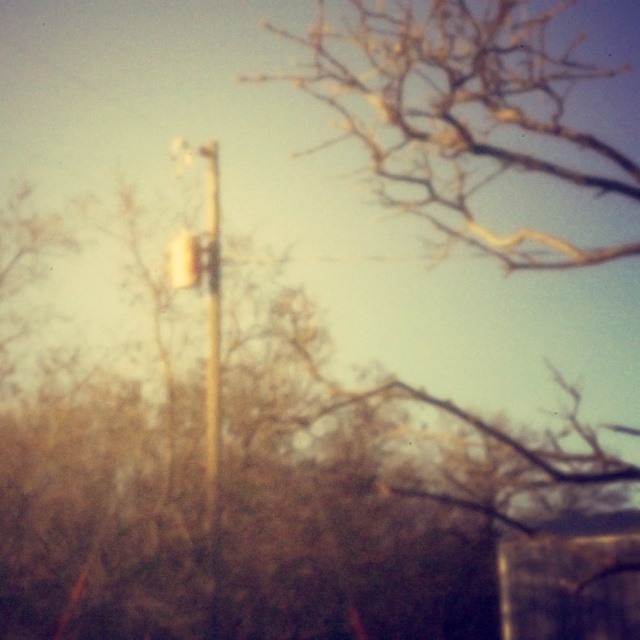
You are a pedestrian standing on the sidewalk and see the wooden pole at center and the metallic silver traffic light at center. Which object is positioned more to the right from your viewpoint?

The wooden pole at center is positioned more to the right than the metallic silver traffic light at center according to the description.

You are driving a car and need to stop at the traffic light. Which object will you stop under, the wooden pole at center or the metallic silver traffic light at center?

The wooden pole at center is positioned under the metallic silver traffic light at center, so you will stop under the metallic silver traffic light at center.